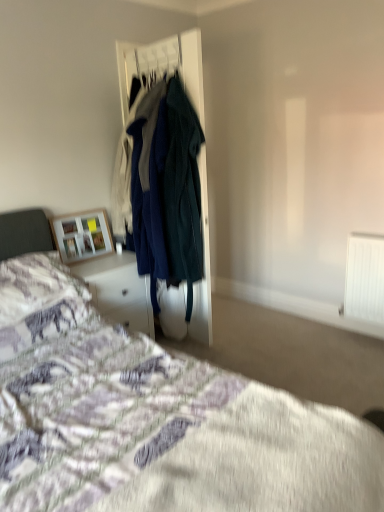
You are a GUI agent. You are given a task and a screenshot of the screen. Output one action in this format:
    pyautogui.click(x=<x>, y=<y>)
    Task: Click on the velvet teal coat at center
    This screenshot has width=384, height=512.
    Given the screenshot: What is the action you would take?
    pyautogui.click(x=174, y=65)

In order to click on fluffy white pillow at lower left in this screenshot , I will do `click(38, 288)`.

What are the coordinates of `purple cotton bedspread at lower left` in the screenshot? It's located at [x=150, y=414].

The image size is (384, 512). Describe the element at coordinates (82, 234) in the screenshot. I see `wooden frame at upper left` at that location.

The height and width of the screenshot is (512, 384). What do you see at coordinates (119, 290) in the screenshot?
I see `white glossy vanity at lower left` at bounding box center [119, 290].

You are a GUI agent. You are given a task and a screenshot of the screen. Output one action in this format:
    pyautogui.click(x=<x>, y=<y>)
    Task: Click on the white glossy vanity at lower left
    This screenshot has height=512, width=384.
    Given the screenshot: What is the action you would take?
    (x=119, y=290)

The image size is (384, 512). What are the coordinates of `dark green wool coat at center` in the screenshot? It's located at (182, 191).

Considering the sizes of objects fluffy white pillow at lower left and wooden frame at upper left in the image provided, who is thinner, fluffy white pillow at lower left or wooden frame at upper left?

With smaller width is wooden frame at upper left.

Which object is closer to the camera, fluffy white pillow at lower left or wooden frame at upper left?

fluffy white pillow at lower left is closer to the camera.

Could you tell me if fluffy white pillow at lower left is facing wooden frame at upper left?

No.

From a real-world perspective, which object stands above the other?

velvet teal coat at center.

Can you tell me how much velvet teal coat at center and wooden frame at upper left differ in facing direction?

The angular difference between velvet teal coat at center and wooden frame at upper left is 83.2 degrees.

Is velvet teal coat at center aimed at wooden frame at upper left?

Yes, velvet teal coat at center is turned towards wooden frame at upper left.

From a real-world perspective, which is physically above, white glossy vanity at lower left or wooden frame at upper left?

In real-world perspective, wooden frame at upper left is above.

Looking at their sizes, would you say white glossy vanity at lower left is wider or thinner than wooden frame at upper left?

white glossy vanity at lower left is wider than wooden frame at upper left.

Which object is closer to the camera taking this photo, white glossy vanity at lower left or wooden frame at upper left?

white glossy vanity at lower left is more forward.

Visually, is white glossy vanity at lower left positioned to the left or to the right of wooden frame at upper left?

Clearly, white glossy vanity at lower left is on the right of wooden frame at upper left in the image.

From the image's perspective, is white glossy vanity at lower left under purple cotton bedspread at lower left?

No.

From a real-world perspective, is white glossy vanity at lower left physically below purple cotton bedspread at lower left?

Yes, from a real-world perspective, white glossy vanity at lower left is beneath purple cotton bedspread at lower left.

Could you tell me if white glossy vanity at lower left is turned towards purple cotton bedspread at lower left?

No.

Is white glossy vanity at lower left smaller than purple cotton bedspread at lower left?

Yes, white glossy vanity at lower left is smaller than purple cotton bedspread at lower left.

Considering the sizes of objects purple cotton bedspread at lower left and white glossy vanity at lower left in the image provided, who is smaller, purple cotton bedspread at lower left or white glossy vanity at lower left?

white glossy vanity at lower left is smaller.

How different are the orientations of purple cotton bedspread at lower left and white glossy vanity at lower left in degrees?

The angular difference between purple cotton bedspread at lower left and white glossy vanity at lower left is 0.945 degrees.

Is purple cotton bedspread at lower left taller or shorter than white glossy vanity at lower left?

purple cotton bedspread at lower left is taller than white glossy vanity at lower left.

Which object is positioned more to the left, purple cotton bedspread at lower left or white glossy vanity at lower left?

white glossy vanity at lower left is more to the left.

From the picture: From a real-world perspective, which is physically below, velvet teal coat at center or white glossy vanity at lower left?

In real-world perspective, white glossy vanity at lower left is lower.

Is velvet teal coat at center closer to camera compared to white glossy vanity at lower left?

Yes, velvet teal coat at center is closer to the camera.

From the image's perspective, which one is positioned lower, velvet teal coat at center or white glossy vanity at lower left?

From the image's view, white glossy vanity at lower left is below.

Is dark green wool coat at center facing towards velvet teal coat at center?

No.

From the image's perspective, who appears lower, dark green wool coat at center or velvet teal coat at center?

dark green wool coat at center is shown below in the image.

Is point (187, 207) positioned before point (178, 303)?

Yes.

Is dark green wool coat at center completely or partially outside of velvet teal coat at center?

dark green wool coat at center is positioned outside velvet teal coat at center.

You are a GUI agent. You are given a task and a screenshot of the screen. Output one action in this format:
    pyautogui.click(x=<x>, y=<y>)
    Task: Click on the pillow that appears below the wooden frame at upper left (from the image's perspective)
    The height and width of the screenshot is (512, 384).
    Given the screenshot: What is the action you would take?
    pyautogui.click(x=38, y=288)

This screenshot has width=384, height=512. What are the coordinates of `closet on the right of wooden frame at upper left` in the screenshot? It's located at (174, 65).

When comparing their distances from wooden frame at upper left, does purple cotton bedspread at lower left or dark green wool coat at center seem closer?

dark green wool coat at center.

Considering their positions, is wooden frame at upper left positioned further to white glossy vanity at lower left than fluffy white pillow at lower left?

Among the two, fluffy white pillow at lower left is located further to white glossy vanity at lower left.

Looking at the image, which one is located closer to fluffy white pillow at lower left, white glossy vanity at lower left or dark green wool coat at center?

white glossy vanity at lower left.

When comparing their distances from purple cotton bedspread at lower left, does white glossy vanity at lower left or fluffy white pillow at lower left seem further?

Among the two, white glossy vanity at lower left is located further to purple cotton bedspread at lower left.

From the picture: Based on their spatial positions, is purple cotton bedspread at lower left or white glossy vanity at lower left closer to dark green wool coat at center?

Based on the image, white glossy vanity at lower left appears to be nearer to dark green wool coat at center.

Estimate the real-world distances between objects in this image. Which object is further from wooden frame at upper left, velvet teal coat at center or dark green wool coat at center?

velvet teal coat at center is positioned further to the anchor wooden frame at upper left.

Based on their spatial positions, is fluffy white pillow at lower left or wooden frame at upper left further from velvet teal coat at center?

Based on the image, fluffy white pillow at lower left appears to be further to velvet teal coat at center.

Based on their spatial positions, is fluffy white pillow at lower left or wooden frame at upper left further from dark green wool coat at center?

Based on the image, fluffy white pillow at lower left appears to be further to dark green wool coat at center.

This screenshot has width=384, height=512. What are the coordinates of `vanity between purple cotton bedspread at lower left and wooden frame at upper left along the z-axis` in the screenshot? It's located at (119, 290).

Image resolution: width=384 pixels, height=512 pixels. What are the coordinates of `vanity between fluffy white pillow at lower left and wooden frame at upper left along the z-axis` in the screenshot? It's located at (119, 290).

Identify the location of picture frame that lies between velvet teal coat at center and white glossy vanity at lower left from top to bottom. The width and height of the screenshot is (384, 512). (82, 234).

Identify the location of pillow between purple cotton bedspread at lower left and dark green wool coat at center from front to back. This screenshot has height=512, width=384. [x=38, y=288].